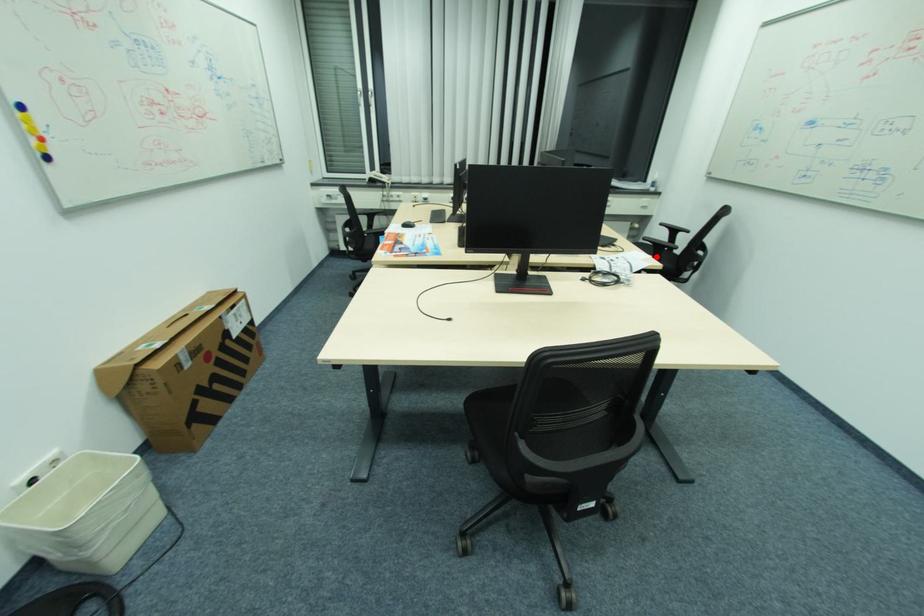
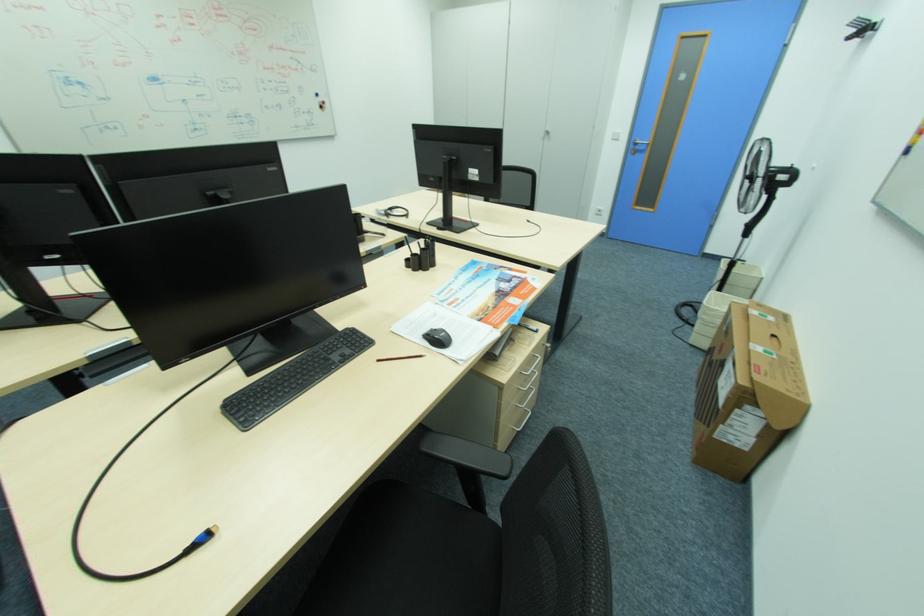
Question: I am providing you with two images of the same scene from different viewpoints. A red point is marked on the first image. Can you still see the location of the red point in image 2?

Choices:
 (A) Yes
 (B) No

Answer: (B)